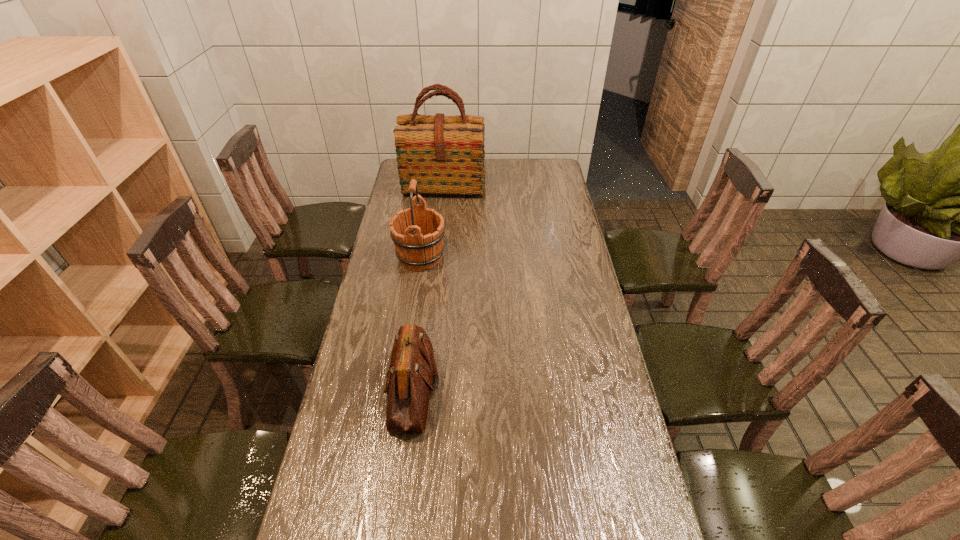
Image resolution: width=960 pixels, height=540 pixels. I want to click on shopping bag that is at the left edge, so click(445, 154).

Where is `wine bucket that is at the left edge`? This screenshot has width=960, height=540. wine bucket that is at the left edge is located at coordinates tap(417, 232).

Find the location of `shoulder bag present at the left edge`. shoulder bag present at the left edge is located at coordinates (412, 368).

The height and width of the screenshot is (540, 960). I want to click on object located at the far left corner, so click(x=445, y=154).

In the image, there is a desktop. Where is `vacant space at the left edge`? vacant space at the left edge is located at coordinates (308, 509).

Identify the location of free space at the right edge. This screenshot has height=540, width=960. (554, 198).

The height and width of the screenshot is (540, 960). In order to click on free space between the shortest object and the second shortest object in this screenshot , I will do `click(417, 323)`.

Find the location of a particular element. vacant area that lies between the second tallest object and the shoulder bag is located at coordinates (417, 323).

This screenshot has width=960, height=540. I want to click on object that ranks as the second closest to the shoulder bag, so click(x=445, y=154).

This screenshot has width=960, height=540. I want to click on object that is the closest to the shopping bag, so click(x=417, y=232).